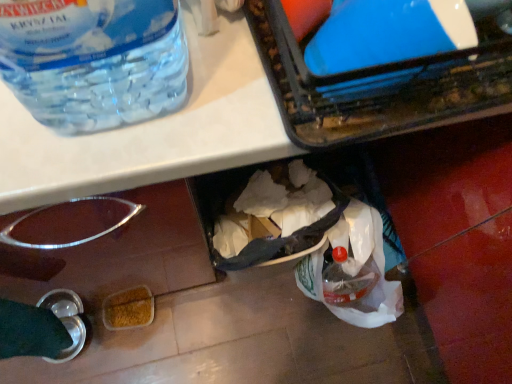
Where is `blue glossy plastic container at upper right`? This screenshot has width=512, height=384. blue glossy plastic container at upper right is located at coordinates (379, 86).

Describe the element at coordinates (379, 86) in the screenshot. This screenshot has width=512, height=384. I see `blue glossy plastic container at upper right` at that location.

In order to face blue glossy plastic container at upper right, should I rotate leftwards or rightwards?

Turn right by 17.747 degrees to look at blue glossy plastic container at upper right.

This screenshot has height=384, width=512. Describe the element at coordinates (93, 60) in the screenshot. I see `transparent plastic bottle at upper left` at that location.

You are a GUI agent. You are given a task and a screenshot of the screen. Output one action in this format:
    pyautogui.click(x=<x>, y=<y>)
    Task: Click on the transparent plastic bottle at upper left
    This screenshot has height=384, width=512.
    Given the screenshot: What is the action you would take?
    pyautogui.click(x=93, y=60)

The width and height of the screenshot is (512, 384). In order to click on blue glossy plastic container at upper right in this screenshot , I will do `click(379, 86)`.

Can you confirm if transparent plastic bottle at upper left is positioned to the left of blue glossy plastic container at upper right?

Yes.

Is transparent plastic bottle at upper left further to the viewer compared to blue glossy plastic container at upper right?

No, it is in front of blue glossy plastic container at upper right.

Is point (77, 98) in front of point (268, 55)?

Yes, it is in front of point (268, 55).

From the image's perspective, is transparent plastic bottle at upper left located above or below blue glossy plastic container at upper right?

From the image's perspective, transparent plastic bottle at upper left appears above blue glossy plastic container at upper right.

From a real-world perspective, is transparent plastic bottle at upper left physically located above or below blue glossy plastic container at upper right?

Clearly, from a real-world perspective, transparent plastic bottle at upper left is below blue glossy plastic container at upper right.

Does transparent plastic bottle at upper left have a greater width compared to blue glossy plastic container at upper right?

Correct, the width of transparent plastic bottle at upper left exceeds that of blue glossy plastic container at upper right.

From their relative heights in the image, would you say transparent plastic bottle at upper left is taller or shorter than blue glossy plastic container at upper right?

Clearly, transparent plastic bottle at upper left is taller compared to blue glossy plastic container at upper right.

Which of these two, transparent plastic bottle at upper left or blue glossy plastic container at upper right, is smaller?

Smaller between the two is blue glossy plastic container at upper right.

Would you say transparent plastic bottle at upper left is inside or outside blue glossy plastic container at upper right?

transparent plastic bottle at upper left exists outside the volume of blue glossy plastic container at upper right.

Is transparent plastic bottle at upper left beside blue glossy plastic container at upper right?

No.

Is transparent plastic bottle at upper left looking in the opposite direction of blue glossy plastic container at upper right?

No, blue glossy plastic container at upper right is not at the back of transparent plastic bottle at upper left.

Identify the location of box on the right of transparent plastic bottle at upper left. click(379, 86).

Between blue glossy plastic container at upper right and transparent plastic bottle at upper left, which one appears on the right side from the viewer's perspective?

From the viewer's perspective, blue glossy plastic container at upper right appears more on the right side.

Is blue glossy plastic container at upper right in front of or behind transparent plastic bottle at upper left in the image?

Clearly, blue glossy plastic container at upper right is behind transparent plastic bottle at upper left.

Between point (306, 72) and point (80, 83), which one is positioned in front?

The point (306, 72) is closer.

From the image's perspective, is blue glossy plastic container at upper right above or below transparent plastic bottle at upper left?

From the image's perspective, blue glossy plastic container at upper right appears below transparent plastic bottle at upper left.

From a real-world perspective, is blue glossy plastic container at upper right below transparent plastic bottle at upper left?

No.

Looking at this image, which object is thinner, blue glossy plastic container at upper right or transparent plastic bottle at upper left?

Thinner between the two is blue glossy plastic container at upper right.

Which of these two, blue glossy plastic container at upper right or transparent plastic bottle at upper left, stands taller?

With more height is transparent plastic bottle at upper left.

Based on the photo, is blue glossy plastic container at upper right smaller than transparent plastic bottle at upper left?

Indeed, blue glossy plastic container at upper right has a smaller size compared to transparent plastic bottle at upper left.

Choose the correct answer: Is blue glossy plastic container at upper right inside transparent plastic bottle at upper left or outside it?

blue glossy plastic container at upper right is outside transparent plastic bottle at upper left.

Would you consider blue glossy plastic container at upper right to be distant from transparent plastic bottle at upper left?

No, blue glossy plastic container at upper right is not far away from transparent plastic bottle at upper left.

Is blue glossy plastic container at upper right facing away from transparent plastic bottle at upper left?

No, blue glossy plastic container at upper right's orientation is not away from transparent plastic bottle at upper left.

Can you tell me how much blue glossy plastic container at upper right and transparent plastic bottle at upper left differ in facing direction?

The angular difference between blue glossy plastic container at upper right and transparent plastic bottle at upper left is 3.6 degrees.

You are a GUI agent. You are given a task and a screenshot of the screen. Output one action in this format:
    pyautogui.click(x=<x>, y=<y>)
    Task: Click on the box that appears on the right of transparent plastic bottle at upper left
    
    Given the screenshot: What is the action you would take?
    pyautogui.click(x=379, y=86)

The width and height of the screenshot is (512, 384). I want to click on bottle above the blue glossy plastic container at upper right (from the image's perspective), so click(93, 60).

Where is `box on the right of transparent plastic bottle at upper left`? This screenshot has width=512, height=384. box on the right of transparent plastic bottle at upper left is located at coordinates (379, 86).